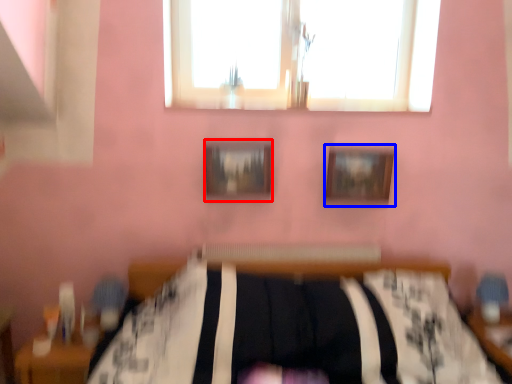
Question: Among these objects, which one is farthest to the camera, picture frame (highlighted by a red box) or picture frame (highlighted by a blue box)?

Choices:
 (A) picture frame
 (B) picture frame

Answer: (B)